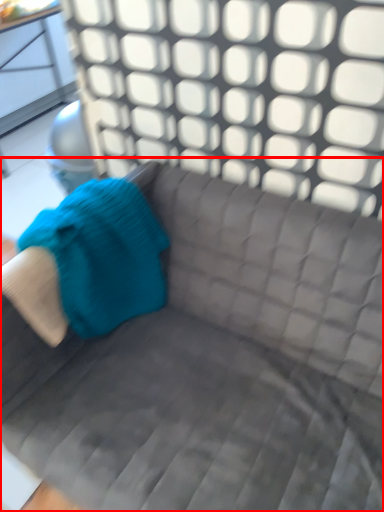
Question: From the image's perspective, where is studio couch (annotated by the red box) located relative to bean bag chair?

Choices:
 (A) below
 (B) above

Answer: (A)